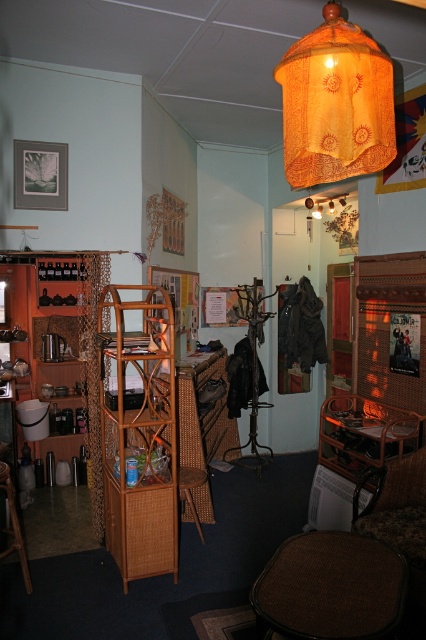
You are sitting on the woven bamboo stool at center and want to reach the brown fabric stool at lower center. Can you directly stand up and step onto it without moving any furniture?

The brown fabric stool at lower center is located above the woven bamboo stool at center, so you can directly stand up and step onto it since it is positioned higher.

You are sitting in the woven wicker chair at lower right and want to see the brown woven stool at lower left. Can you see it directly in front of you?

The brown woven stool at lower left is behind the woven wicker chair at lower right, so you cannot see it directly in front of you.

You are a customer in the space and want to sit comfortably while reading a book. Which of the two seating options, the woven wicker chair at lower right or the brown woven stool at lower left, would be more suitable for a taller person?

The brown woven stool at lower left is taller than the woven wicker chair at lower right, so it would be more suitable for a taller person.